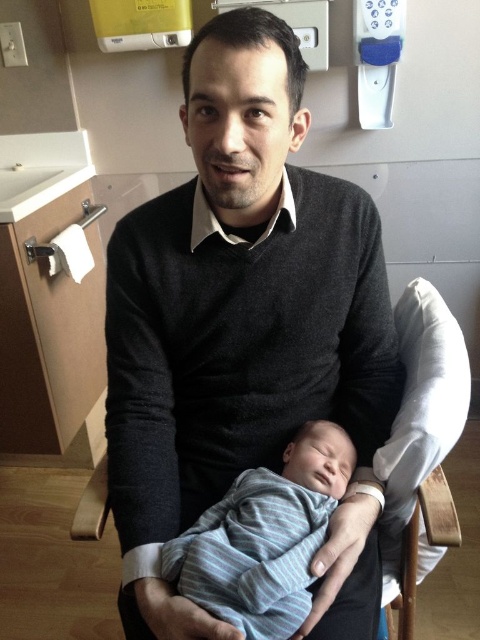
You are a photographer standing 3 feet away from the striped knit onesie at center. You want to take a closeup photo of it. Do you need to move closer or farther away?

The striped knit onesie at center is currently 27.16 inches away from the camera. Since you are standing 3 feet away, which is 36 inches, you need to move closer by approximately 8.84 inches to get a closeup photo.

In the hospital room scene, there is a striped knit onesie at center and a wooden rocking chair at center. From the perspective of someone standing in front of the chair, which object is positioned to the left?

The striped knit onesie at center is to the left of the wooden rocking chair at center, so from the perspective of someone standing in front of the wooden rocking chair at center, the striped knit onesie at center would be on the left side.

Based on the photo, you are standing in the hospital room and want to place a small gift basket for the newborn baby. The gift basket requires a flat surface that is at least 2 feet away from you to avoid disturbing the baby. Is the point at coordinates point (304, 419) suitable for placing the gift basket?

The distance of point (304, 419) from viewer is 3.28 feet, which is more than the required 2 feet. Therefore, the point at coordinates point (304, 419) is suitable for placing the gift basket without disturbing the baby.